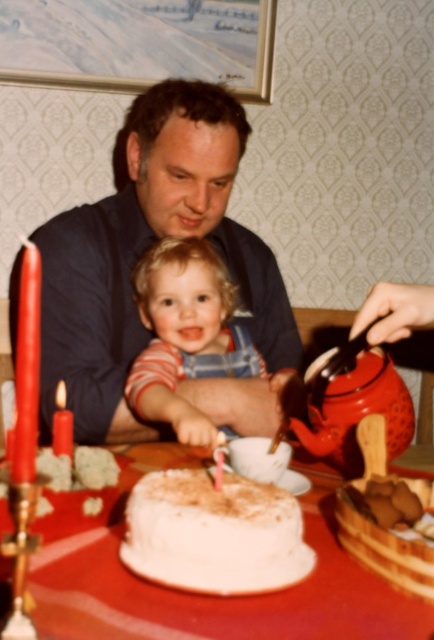
In the scene shown: Is blonde hair baby at center above red wax candle at left?

Actually, blonde hair baby at center is below red wax candle at left.

Where is `blonde hair baby at center`? Image resolution: width=434 pixels, height=640 pixels. blonde hair baby at center is located at coordinates (186, 333).

Is point (38, 380) farther from camera compared to point (55, 396)?

No, it is not.

This screenshot has height=640, width=434. In order to click on red wax candle at left in this screenshot , I will do `click(26, 365)`.

Who is lower down, white frosted cake at center or red wax candle at left?

white frosted cake at center

Can you confirm if white frosted cake at center is taller than red wax candle at left?

In fact, white frosted cake at center may be shorter than red wax candle at left.

This screenshot has width=434, height=640. What do you see at coordinates (213, 532) in the screenshot?
I see `white frosted cake at center` at bounding box center [213, 532].

You are a GUI agent. You are given a task and a screenshot of the screen. Output one action in this format:
    pyautogui.click(x=<x>, y=<y>)
    Task: Click on the white frosted cake at center
    Image resolution: width=434 pixels, height=640 pixels.
    Given the screenshot: What is the action you would take?
    pyautogui.click(x=213, y=532)